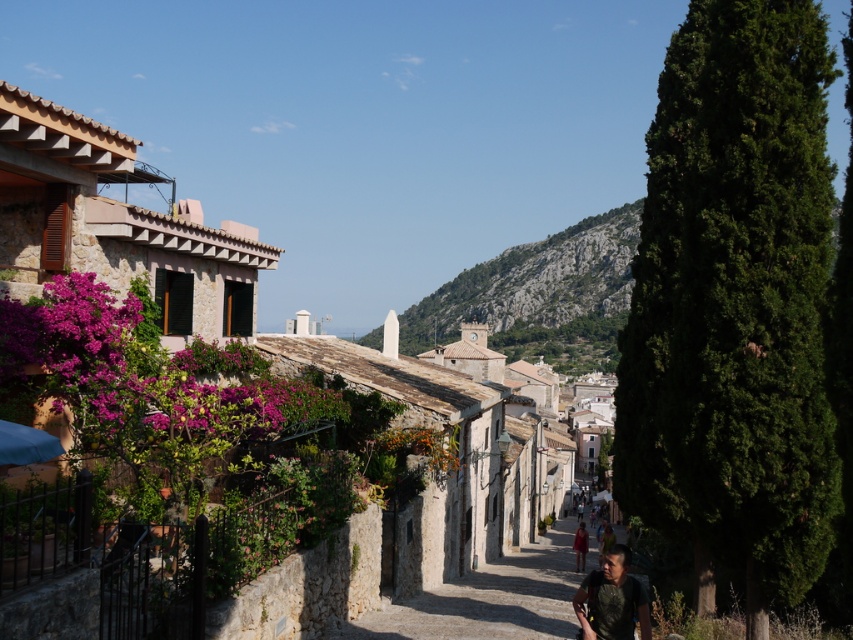
Identify the location of stone village at center. The image size is (853, 640). (283, 333).

Who is shorter, stone village at center or matte red dress at center?

matte red dress at center is shorter.

Who is more distant from viewer, (91, 125) or (583, 560)?

The point (583, 560) is more distant.

At what (x,y) coordinates should I click in order to perform the action: click on stone village at center. Please return your answer as a coordinate pair (x, y). Looking at the image, I should click on (283, 333).

I want to click on green leafy cypress at right, so click(734, 301).

Is point (664, 458) farther from camera compared to point (576, 544)?

No, it is in front of (576, 544).

Identify the location of green leafy cypress at right. This screenshot has width=853, height=640. (734, 301).

Describe the element at coordinates (734, 301) in the screenshot. I see `green leafy cypress at right` at that location.

Which of these two, green leafy cypress at right or stone paved path at center, stands taller?

green leafy cypress at right is taller.

Who is more forward, (x=770, y=572) or (x=515, y=552)?

Point (x=770, y=572) is in front.

This screenshot has width=853, height=640. Identify the location of green leafy cypress at right. (734, 301).